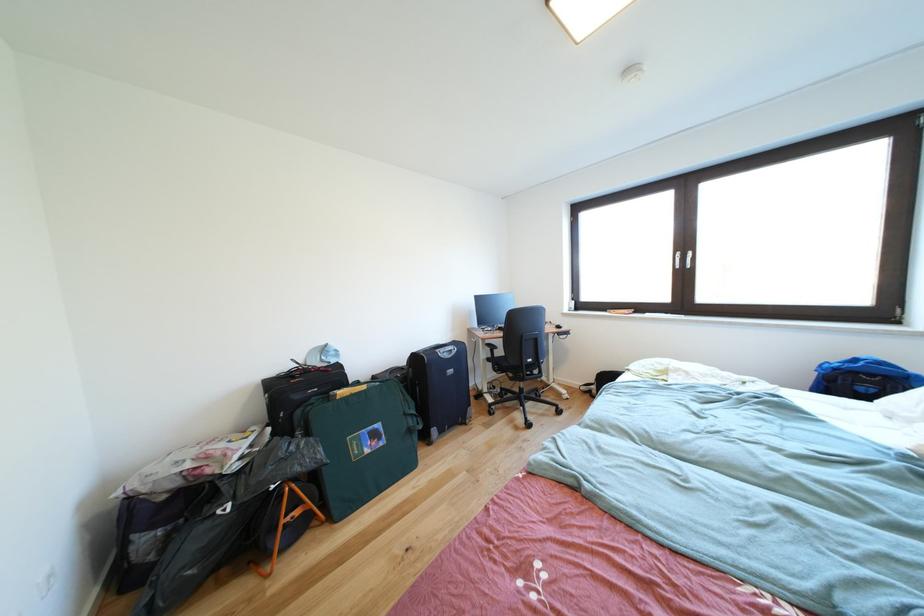
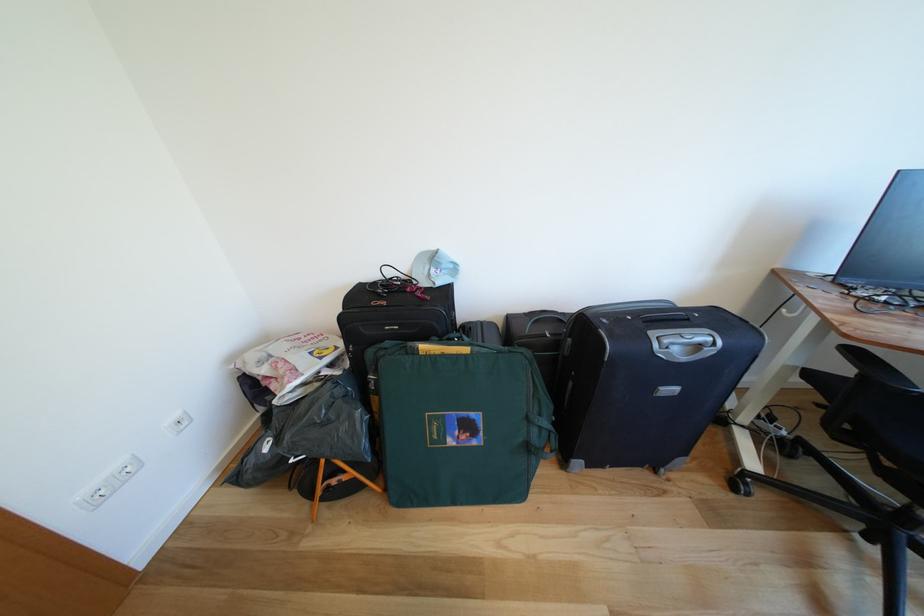
In the second image, find the point that corresponds to pixel 496 350 in the first image.

(862, 357)